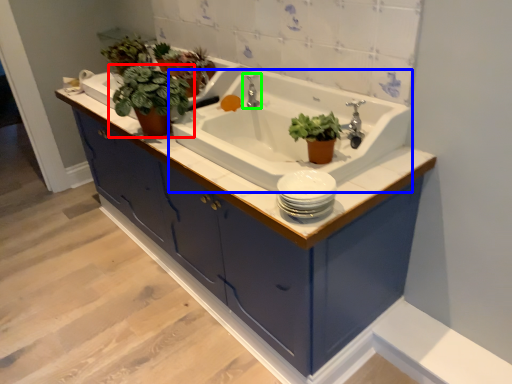
Question: Estimate the real-world distances between objects in this image. Which object is farther from houseplant (highlighted by a red box), sink (highlighted by a blue box) or tap (highlighted by a green box)?

Choices:
 (A) sink
 (B) tap

Answer: (B)